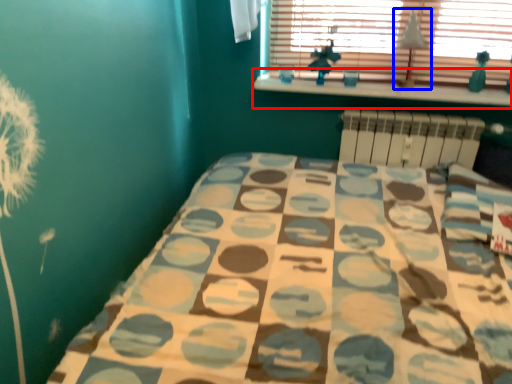
Question: Which point is closer to the camera, window sill (highlighted by a red box) or lamp (highlighted by a blue box)?

Choices:
 (A) window sill
 (B) lamp

Answer: (B)